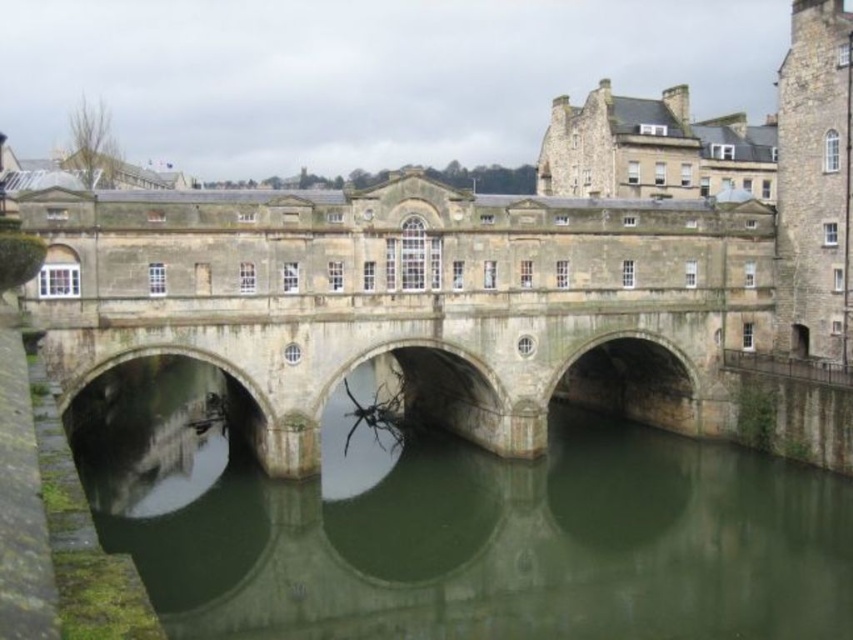
Does green stone bridge at center have a greater height compared to stone bridge at center?

No, green stone bridge at center is not taller than stone bridge at center.

Does point (807, 468) lie behind point (502, 208)?

Yes, it is behind point (502, 208).

The image size is (853, 640). I want to click on green stone bridge at center, so click(x=461, y=529).